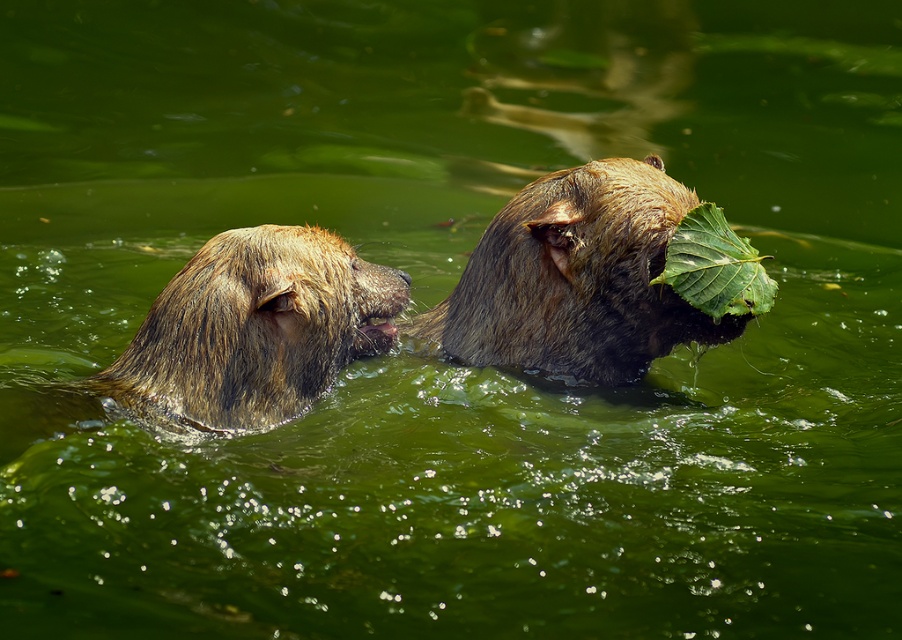
Based on the photo, you are a wildlife photographer trying to capture a closeup shot of the brown fur bear at left and the green leafy at right. Given the distance between them, can you estimate if they will fit in your camera frame if your camera has a maximum field of view of 70 centimeters?

The distance between the brown fur bear at left and the green leafy at right is 73.23 centimeters, which exceeds the camera frame field of view of 70 centimeters. Therefore, they cannot both fit within the frame simultaneously.

You are a photographer trying to capture the two dogs in the water. You want to position your camera so that the dog at point (661, 260) is in the foreground and the dog at point (721, 285) is in the background. Is this possible based on their current positions?

No, because according to the description, point (661, 260) is behind point (721, 285). This means the dog at point (721, 285) would be closer to the camera, making it the foreground, while the dog at point (661, 260) would be further back in the background.

You are a photographer trying to capture the two dogs in the water. You notice two points of interest marked as point (652, 253) and point (338, 298). Which point is closer to your camera lens?

Point (652, 253) is further to the viewer than point (338, 298), so the point closer to the camera lens is point (338, 298).